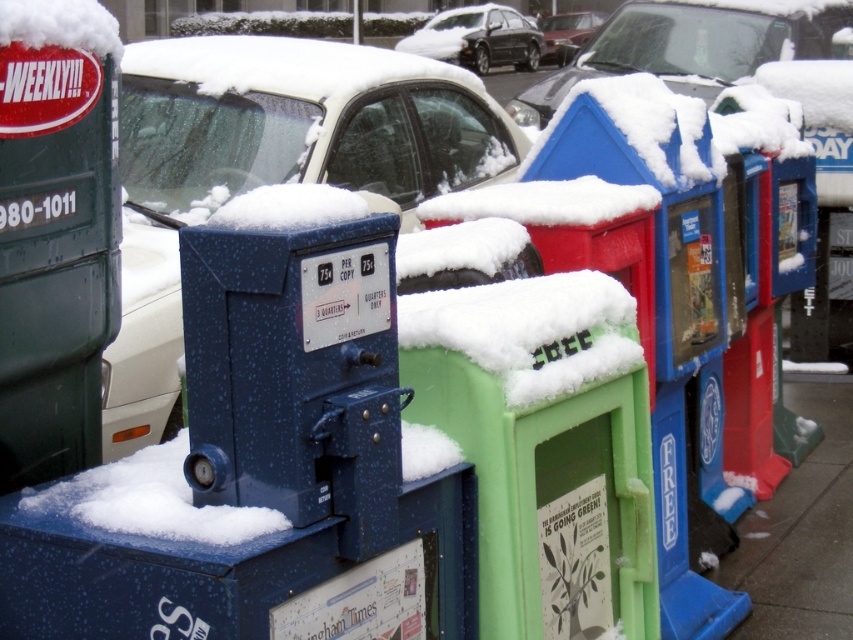
Does gray concrete sidewalk at lower right have a lesser width compared to snow-covered car at center?

Yes.

Between point (718, 573) and point (618, 8), which one is positioned in front?

Point (718, 573)

Who is more distant from viewer, (811, 554) or (546, 88)?

The point (546, 88) is more distant.

Locate an element on the screen. The image size is (853, 640). gray concrete sidewalk at lower right is located at coordinates (801, 532).

At what (x,y) coordinates should I click in order to perform the action: click on blue metallic newspaper box at left. Please return your answer as a coordinate pair (x, y). This screenshot has height=640, width=853. Looking at the image, I should click on coord(270,168).

Which is behind, point (466, 83) or point (97, 48)?

The point (466, 83) is behind.

Where is `blue metallic newspaper box at left`? blue metallic newspaper box at left is located at coordinates (270, 168).

Who is lower down, white fluffy snow at upper left or metallic silver sedan at center?

white fluffy snow at upper left is lower down.

Who is more forward, [30,29] or [572,20]?

Point [30,29] is more forward.

Locate an element on the screen. white fluffy snow at upper left is located at coordinates (61, 26).

At what (x,y) coordinates should I click in order to perform the action: click on white fluffy snow at upper left. Please return your answer as a coordinate pair (x, y). Looking at the image, I should click on (61, 26).